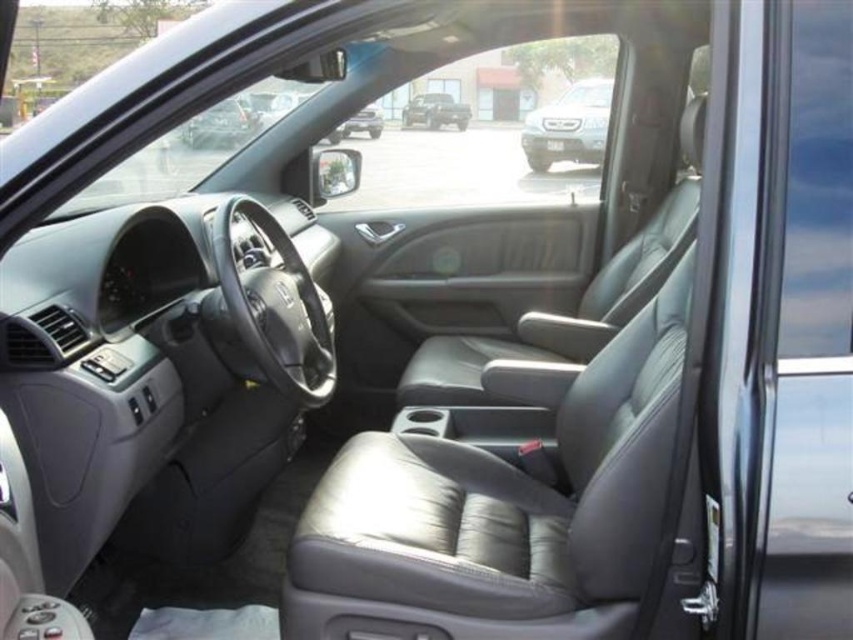
Question: From the image, what is the correct spatial relationship of satin silver suv at center in relation to matte black suv at center?

Choices:
 (A) left
 (B) right

Answer: (B)

Question: Can you confirm if matte black car at upper left is positioned below matte black truck at center?

Choices:
 (A) no
 (B) yes

Answer: (B)

Question: Which of the following is the farthest from the observer?

Choices:
 (A) (194, 131)
 (B) (410, 113)

Answer: (B)

Question: Which object appears farthest from the camera in this image?

Choices:
 (A) satin silver suv at center
 (B) matte black truck at center
 (C) matte black suv at center

Answer: (C)

Question: Which object is the closest to the matte black truck at center?

Choices:
 (A) matte black suv at center
 (B) matte black car at upper left
 (C) satin silver suv at center

Answer: (A)

Question: Is matte black car at upper left smaller than matte black truck at center?

Choices:
 (A) no
 (B) yes

Answer: (A)